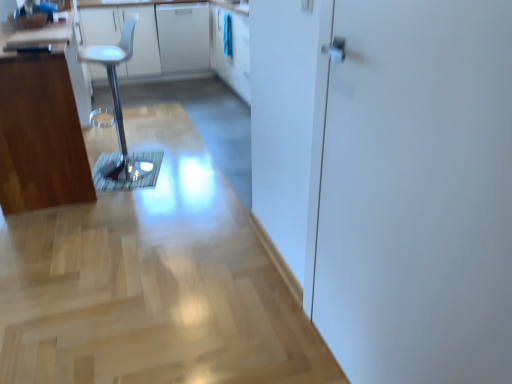
Question: Would you say white glossy door at right is outside white plastic stool at left?

Choices:
 (A) no
 (B) yes

Answer: (B)

Question: Does white glossy door at right have a larger size compared to white plastic stool at left?

Choices:
 (A) no
 (B) yes

Answer: (A)

Question: From the image's perspective, would you say white glossy door at right is positioned over white plastic stool at left?

Choices:
 (A) yes
 (B) no

Answer: (B)

Question: From the image's perspective, would you say white glossy door at right is shown under white plastic stool at left?

Choices:
 (A) yes
 (B) no

Answer: (A)

Question: Can you confirm if white glossy door at right is wider than white plastic stool at left?

Choices:
 (A) no
 (B) yes

Answer: (A)

Question: In terms of width, does white glossy counter top at upper left look wider or thinner when compared to white glossy cabinet at upper center, the first cabinetry viewed from the top?

Choices:
 (A) thin
 (B) wide

Answer: (A)

Question: Based on their positions, is white glossy counter top at upper left located to the left or right of white glossy cabinet at upper center, the first cabinetry viewed from the top?

Choices:
 (A) right
 (B) left

Answer: (B)

Question: From a real-world perspective, is white glossy counter top at upper left positioned above or below white glossy cabinet at upper center, positioned as the 2th cabinetry in front-to-back order?

Choices:
 (A) below
 (B) above

Answer: (B)

Question: Considering the positions of white glossy counter top at upper left and white glossy cabinet at upper center, the second cabinetry positioned from the bottom, in the image, is white glossy counter top at upper left taller or shorter than white glossy cabinet at upper center, the second cabinetry positioned from the bottom,?

Choices:
 (A) tall
 (B) short

Answer: (A)

Question: Considering the positions of white glossy door at right and white glossy cabinet at upper center, the first cabinetry viewed from the top, in the image, is white glossy door at right wider or thinner than white glossy cabinet at upper center, the first cabinetry viewed from the top,?

Choices:
 (A) thin
 (B) wide

Answer: (A)

Question: Considering the relative positions of white glossy door at right and white glossy cabinet at upper center, the first cabinetry viewed from the top, in the image provided, is white glossy door at right to the left or to the right of white glossy cabinet at upper center, the first cabinetry viewed from the top,?

Choices:
 (A) right
 (B) left

Answer: (A)

Question: From a real-world perspective, is white glossy door at right positioned above or below white glossy cabinet at upper center, the first cabinetry viewed from the top?

Choices:
 (A) below
 (B) above

Answer: (B)

Question: Does point (356, 74) appear closer or farther from the camera than point (196, 36)?

Choices:
 (A) farther
 (B) closer

Answer: (B)

Question: From the image's perspective, is white glossy door at right positioned above or below white glossy counter top at upper left?

Choices:
 (A) below
 (B) above

Answer: (A)

Question: Considering the relative positions of white glossy door at right and white glossy counter top at upper left in the image provided, is white glossy door at right to the left or to the right of white glossy counter top at upper left?

Choices:
 (A) right
 (B) left

Answer: (A)